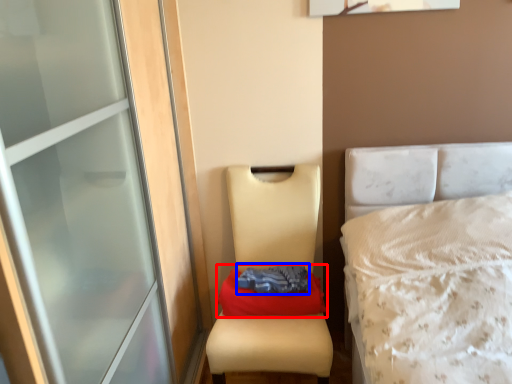
Question: Which object appears farthest to the camera in this image, material (highlighted by a red box) or clothing (highlighted by a blue box)?

Choices:
 (A) material
 (B) clothing

Answer: (A)